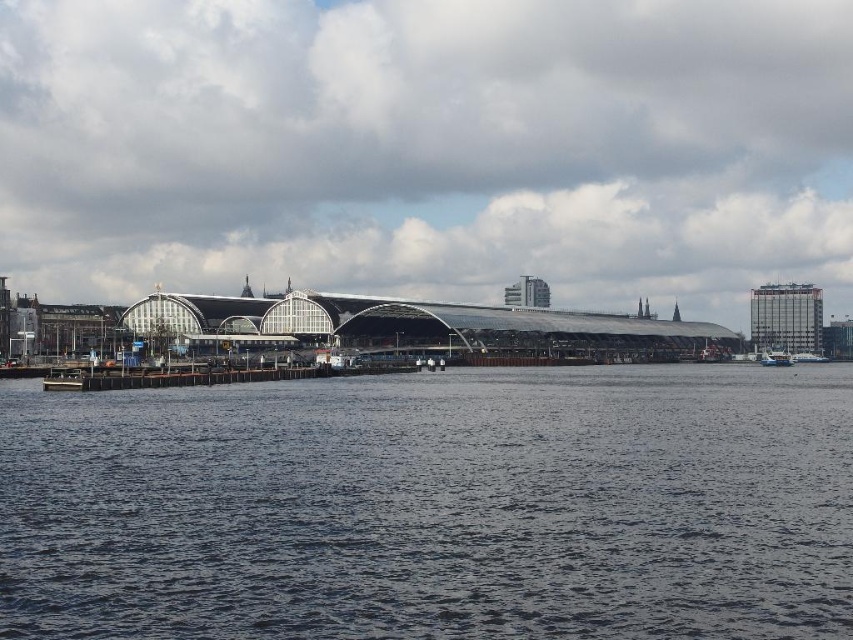
Does dark blue water at center have a lesser width compared to metallic silver boat at lower right?

No, dark blue water at center is not thinner than metallic silver boat at lower right.

Is dark blue water at center below metallic silver boat at lower right?

Correct, dark blue water at center is located below metallic silver boat at lower right.

Is point (154, 392) closer to camera compared to point (776, 364)?

Yes.

You are a GUI agent. You are given a task and a screenshot of the screen. Output one action in this format:
    pyautogui.click(x=<x>, y=<y>)
    Task: Click on the dark blue water at center
    The image size is (853, 640).
    Given the screenshot: What is the action you would take?
    pyautogui.click(x=434, y=506)

Does transparent glass building at center have a lesser width compared to dark blue water at center?

No.

Is point (469, 156) positioned before point (718, 404)?

No, (469, 156) is further to viewer.

Identify the location of transparent glass building at center. This screenshot has height=640, width=853. (428, 148).

What do you see at coordinates (434, 506) in the screenshot? This screenshot has width=853, height=640. I see `dark blue water at center` at bounding box center [434, 506].

Is point (844, 624) positioned in front of point (798, 356)?

Yes.

Find the location of a particular element. dark blue water at center is located at coordinates (434, 506).